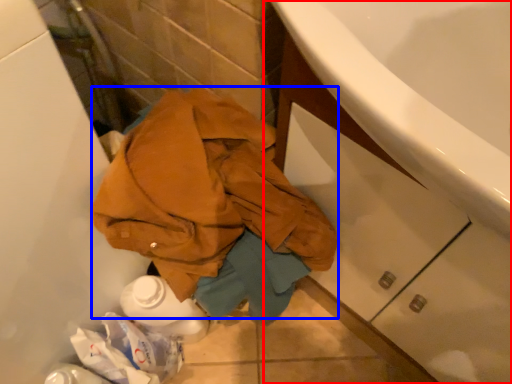
Question: Among these objects, which one is farthest to the camera, bathroom cabinet (highlighted by a red box) or clothing (highlighted by a blue box)?

Choices:
 (A) bathroom cabinet
 (B) clothing

Answer: (B)